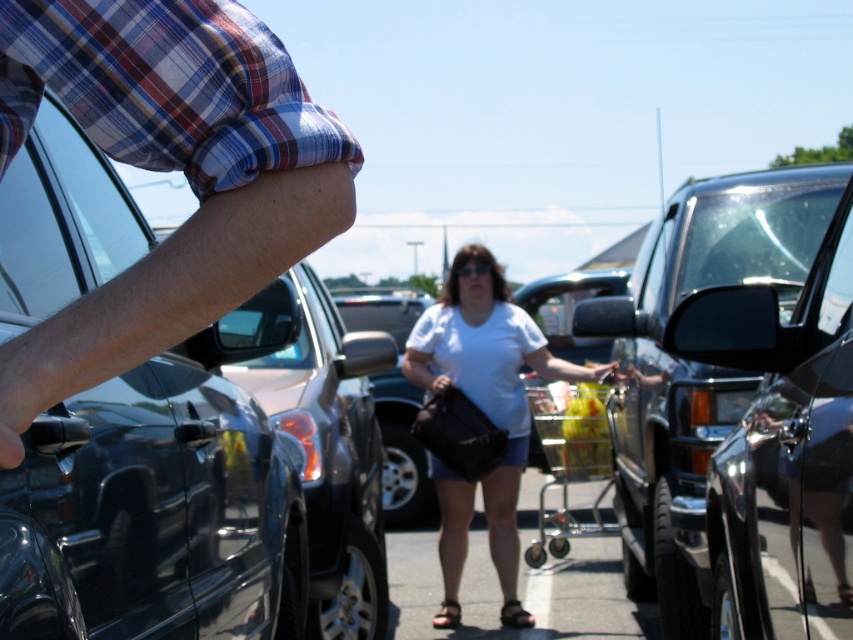
Question: In this image, where is glossy black car at center located relative to white matte shirt at center?

Choices:
 (A) above
 (B) below

Answer: (A)

Question: Does plaid fabric sleeve at upper left have a lesser width compared to glossy black car at center?

Choices:
 (A) yes
 (B) no

Answer: (A)

Question: Which point is closer to the camera?

Choices:
 (A) (225, 179)
 (B) (759, 627)

Answer: (A)

Question: Which object is farther from the camera taking this photo?

Choices:
 (A) glossy black car at center
 (B) white matte shirt at center
 (C) plaid fabric sleeve at upper left

Answer: (B)

Question: Which of these objects is positioned farthest from the plaid fabric sleeve at upper left?

Choices:
 (A) glossy black car at center
 (B) white matte shirt at center

Answer: (B)

Question: Does plaid fabric sleeve at upper left have a greater width compared to glossy black car at center?

Choices:
 (A) no
 (B) yes

Answer: (A)